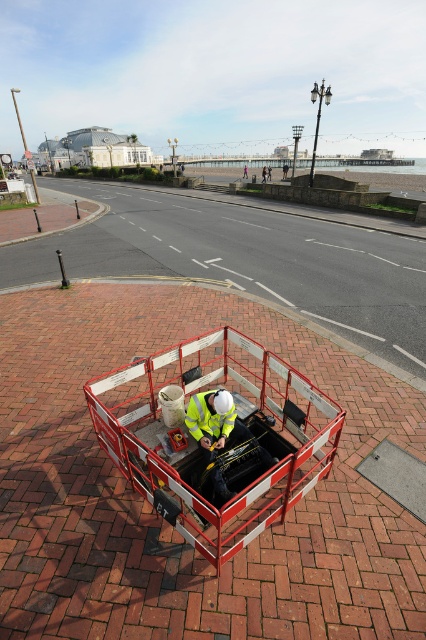
Consider the image. Between reflective yellow vest at center and metallic red cart at center, which one has more height?

reflective yellow vest at center is taller.

Is point (319, 307) closer to camera compared to point (290, 397)?

No.

Between point (115, 237) and point (215, 481), which one is positioned in front?

Point (215, 481) is in front.

Image resolution: width=426 pixels, height=640 pixels. In order to click on reflective yellow vest at center in this screenshot , I will do `click(166, 346)`.

Is metallic red cart at center to the left of high visibility fabric safety vest at center from the viewer's perspective?

Correct, you'll find metallic red cart at center to the left of high visibility fabric safety vest at center.

Is point (282, 412) positioned before point (230, 429)?

No, it is behind (230, 429).

I want to click on metallic red cart at center, so click(x=216, y=436).

Does reflective yellow vest at center appear on the left side of high visibility fabric safety vest at center?

Indeed, reflective yellow vest at center is positioned on the left side of high visibility fabric safety vest at center.

Measure the distance between reflective yellow vest at center and high visibility fabric safety vest at center.

reflective yellow vest at center is 15.19 feet from high visibility fabric safety vest at center.

Does point (31, 246) come farther from viewer compared to point (210, 426)?

Yes.

Locate an element on the screen. reflective yellow vest at center is located at coordinates (166, 346).